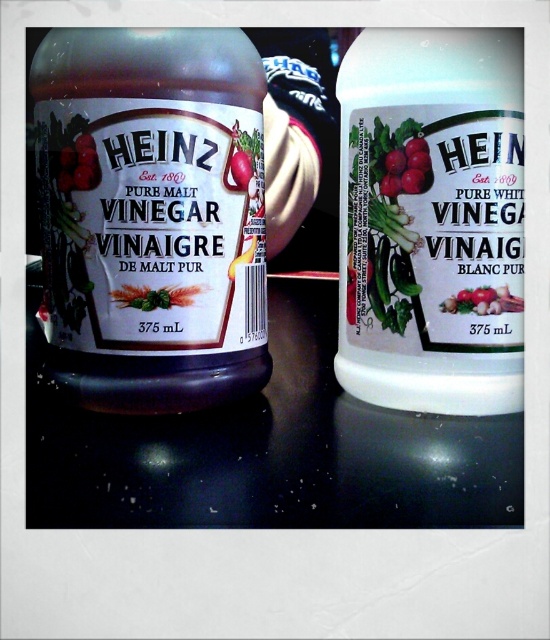
Does matte glass bottle at left have a larger size compared to red glossy radish at center?

Yes.

Describe the element at coordinates (151, 216) in the screenshot. I see `matte glass bottle at left` at that location.

Find the location of a particular element. This screenshot has height=640, width=550. matte glass bottle at left is located at coordinates (151, 216).

Is point (478, 92) farther from viewer compared to point (497, 312)?

That is False.

Between white matte bottle at center and red glossy radish at center, which one has more height?

white matte bottle at center

The height and width of the screenshot is (640, 550). I want to click on white matte bottle at center, so click(431, 218).

Does matte glass bottle at left have a greater height compared to white matte bottle at center?

No, matte glass bottle at left is not taller than white matte bottle at center.

Can you confirm if matte glass bottle at left is positioned above white matte bottle at center?

Correct, matte glass bottle at left is located above white matte bottle at center.

Is point (151, 252) positioned after point (360, 344)?

That is False.

Image resolution: width=550 pixels, height=640 pixels. Find the location of `matte glass bottle at left`. matte glass bottle at left is located at coordinates 151,216.